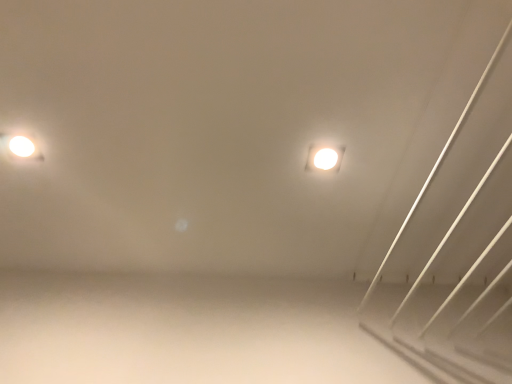
Question: Is matte white light fixture at upper left, which ranks as the second lamp in right-to-left order, wider or thinner than white glossy light fixture at upper center, acting as the 2th lamp starting from the left?

Choices:
 (A) thin
 (B) wide

Answer: (A)

Question: From a real-world perspective, relative to white glossy light fixture at upper center, acting as the 2th lamp starting from the left, is matte white light fixture at upper left, which is the first lamp in left-to-right order, vertically above or below?

Choices:
 (A) below
 (B) above

Answer: (B)

Question: Considering the positions of matte white light fixture at upper left, which is the first lamp in left-to-right order, and white glossy light fixture at upper center, the 1th lamp when ordered from right to left, in the image, is matte white light fixture at upper left, which is the first lamp in left-to-right order, taller or shorter than white glossy light fixture at upper center, the 1th lamp when ordered from right to left,?

Choices:
 (A) tall
 (B) short

Answer: (A)

Question: In terms of width, does white glossy light fixture at upper center, acting as the 2th lamp starting from the left, look wider or thinner when compared to matte white light fixture at upper left, which ranks as the second lamp in right-to-left order?

Choices:
 (A) thin
 (B) wide

Answer: (B)

Question: Is point (332, 170) closer or farther from the camera than point (22, 142)?

Choices:
 (A) farther
 (B) closer

Answer: (A)

Question: Relative to matte white light fixture at upper left, which ranks as the second lamp in right-to-left order, is white glossy light fixture at upper center, acting as the 2th lamp starting from the left, in front or behind?

Choices:
 (A) front
 (B) behind

Answer: (B)

Question: In the image, is white glossy light fixture at upper center, the 1th lamp when ordered from right to left, on the left side or the right side of matte white light fixture at upper left, which is the first lamp in left-to-right order?

Choices:
 (A) right
 (B) left

Answer: (A)